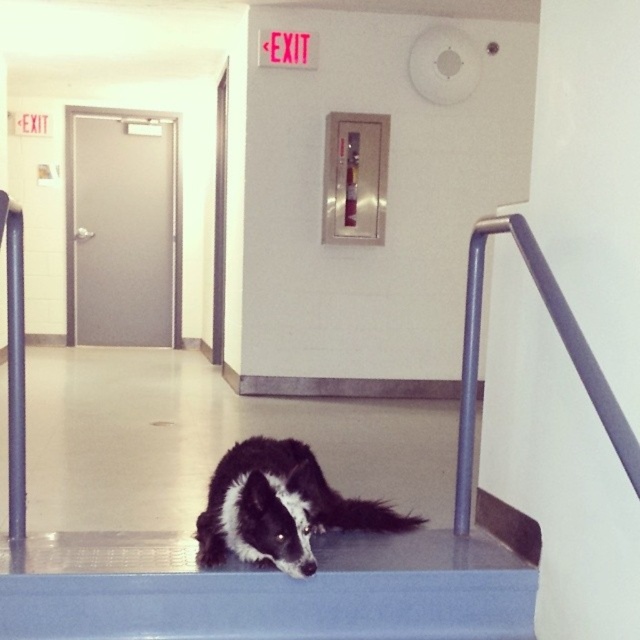
Question: Which object appears farthest from the camera in this image?

Choices:
 (A) black fur dog at center
 (B) metallic gray handrail at upper right

Answer: (A)

Question: Which point is farther from the camera taking this photo?

Choices:
 (A) (179, 330)
 (B) (230, 520)

Answer: (A)

Question: Considering the relative positions of black fur dog at center and black fur tail at lower center in the image provided, where is black fur dog at center located with respect to black fur tail at lower center?

Choices:
 (A) right
 (B) left

Answer: (B)

Question: Does gray metallic door at left appear over metallic gray handrail at upper right?

Choices:
 (A) yes
 (B) no

Answer: (A)

Question: Which point is farther to the camera?

Choices:
 (A) (113, 147)
 (B) (282, 502)

Answer: (A)

Question: Is black fur dog at center smaller than black fur tail at lower center?

Choices:
 (A) no
 (B) yes

Answer: (A)